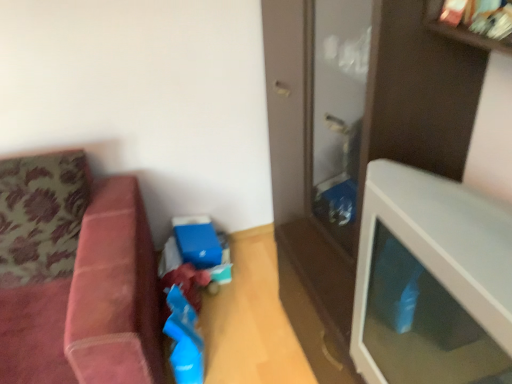
Question: Is point (49, 321) positioned closer to the camera than point (441, 360)?

Choices:
 (A) farther
 (B) closer

Answer: (A)

Question: From their relative heights in the image, would you say velvet pink couch at left is taller or shorter than white glossy table at right?

Choices:
 (A) tall
 (B) short

Answer: (A)

Question: From a real-world perspective, is velvet pink couch at left positioned above or below white glossy table at right?

Choices:
 (A) below
 (B) above

Answer: (A)

Question: Looking at the image, does white glossy table at right seem bigger or smaller compared to velvet pink couch at left?

Choices:
 (A) small
 (B) big

Answer: (A)

Question: Looking at their shapes, would you say white glossy table at right is wider or thinner than velvet pink couch at left?

Choices:
 (A) wide
 (B) thin

Answer: (B)

Question: Would you say white glossy table at right is to the left or to the right of velvet pink couch at left in the picture?

Choices:
 (A) right
 (B) left

Answer: (A)

Question: In terms of height, does white glossy table at right look taller or shorter compared to velvet pink couch at left?

Choices:
 (A) tall
 (B) short

Answer: (B)